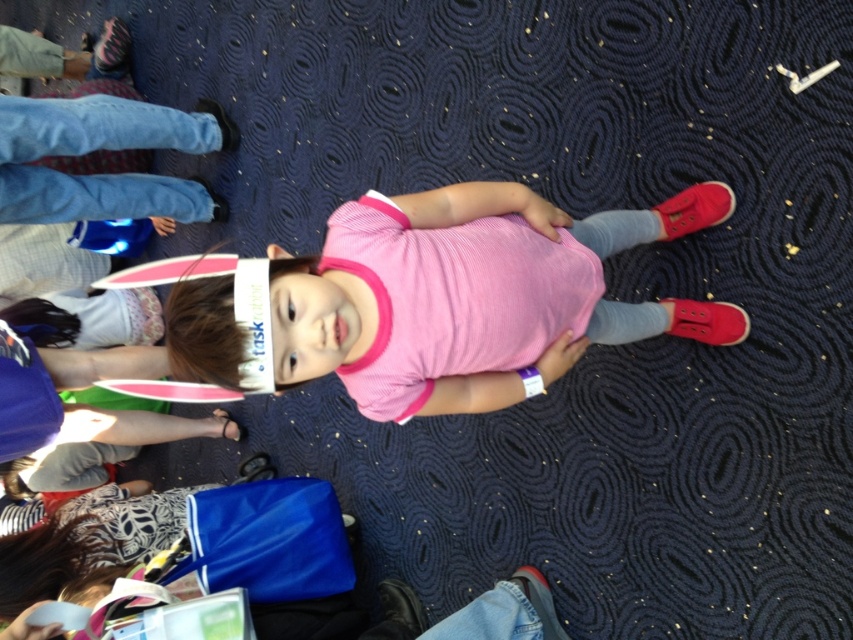
Which is above, pink ribbed shirt at center or pink ribbed fabric dress at center?

Positioned higher is pink ribbed shirt at center.

In the scene shown: Is pink ribbed shirt at center wider than pink ribbed fabric dress at center?

Yes.

Consider the image. Who is more distant from viewer, (303, 269) or (515, 266)?

The point (515, 266) is more distant.

What are the coordinates of `pink ribbed shirt at center` in the screenshot? It's located at (473, 298).